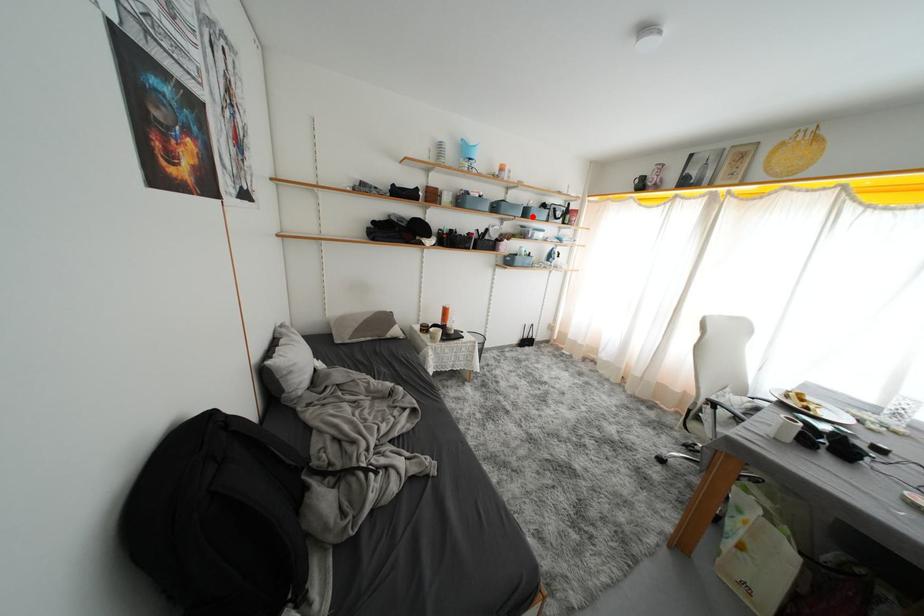
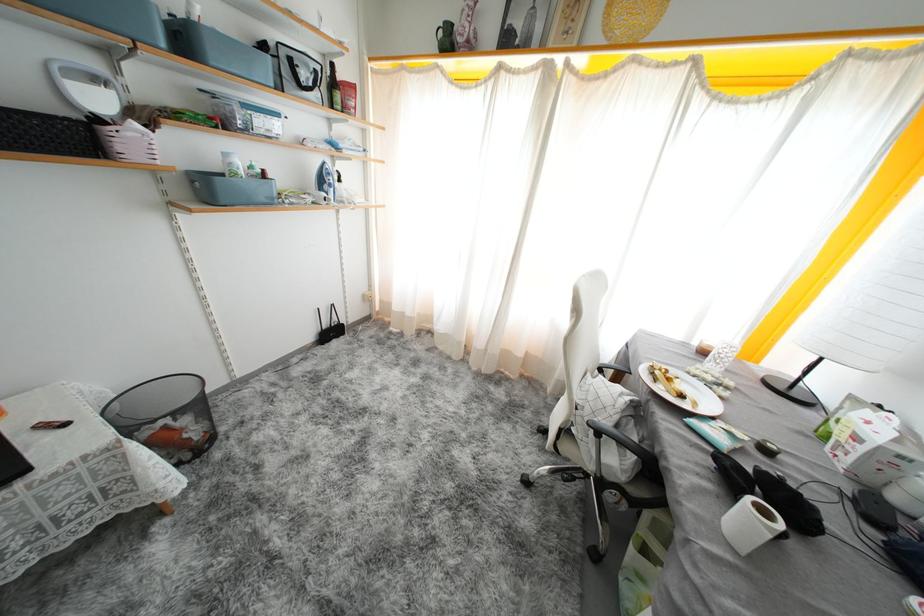
Question: A red point is marked in image1. In image2, is the corresponding 3D point closer to the camera or farther? Reply with the corresponding letter.

Choices:
 (A) The corresponding 3D point is closer.
 (B) The corresponding 3D point is farther.

Answer: (B)